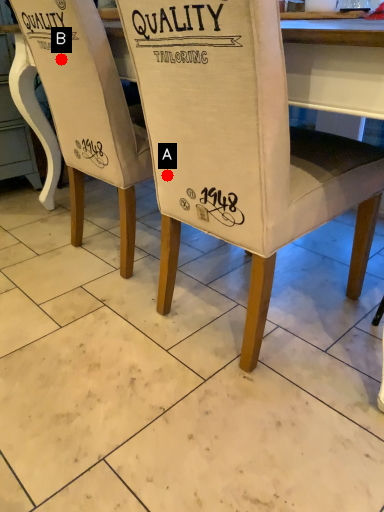
Question: Two points are circled on the image, labeled by A and B beside each circle. Which point appears farthest from the camera in this image?

Choices:
 (A) A is further
 (B) B is further

Answer: (B)